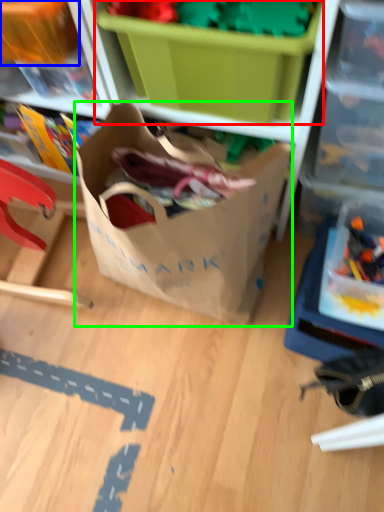
Question: Which is nearer to the storage box (highlighted by a red box)? storage box (highlighted by a blue box) or bag (highlighted by a green box).

Choices:
 (A) storage box
 (B) bag

Answer: (B)